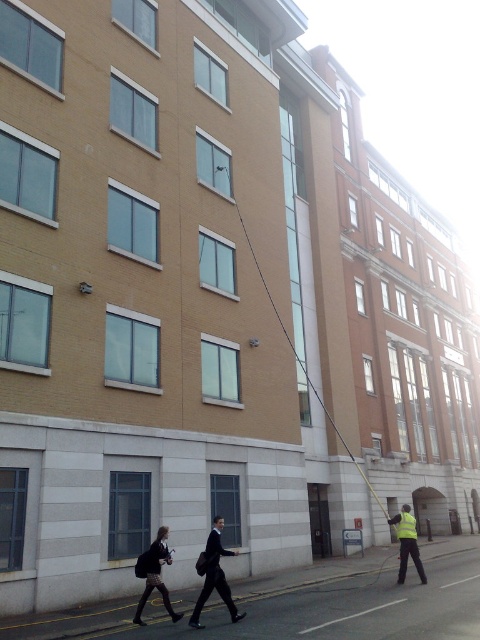
Does dark suit at center have a smaller size compared to reflective yellow vest at lower right?

Correct, dark suit at center occupies less space than reflective yellow vest at lower right.

Can you confirm if dark suit at center is taller than reflective yellow vest at lower right?

No.

Does point (199, 608) come in front of point (408, 545)?

Yes, point (199, 608) is in front of point (408, 545).

Identify the location of dark suit at center. (214, 576).

Can you confirm if dark gray skirt at lower left is wider than reflective yellow vest at lower right?

Incorrect, dark gray skirt at lower left's width does not surpass reflective yellow vest at lower right's.

Can you confirm if dark gray skirt at lower left is shorter than reflective yellow vest at lower right?

Yes, dark gray skirt at lower left is shorter than reflective yellow vest at lower right.

Is point (148, 576) positioned in front of point (405, 561)?

That is True.

Locate an element on the screen. Image resolution: width=480 pixels, height=640 pixels. dark gray skirt at lower left is located at coordinates (155, 573).

Is dark suit at center taller than dark gray skirt at lower left?

Indeed, dark suit at center has a greater height compared to dark gray skirt at lower left.

Is point (189, 625) less distant than point (147, 554)?

Yes, it is in front of point (147, 554).

Where is `dark suit at center`? The width and height of the screenshot is (480, 640). dark suit at center is located at coordinates (214, 576).